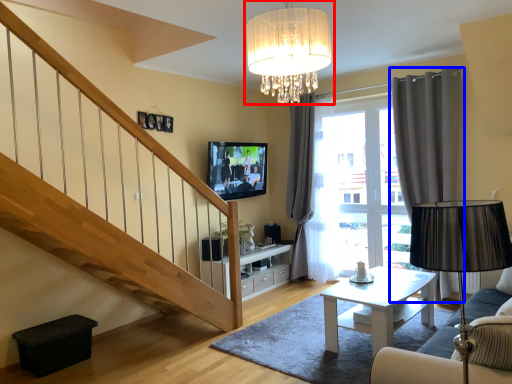
Question: Which object appears farthest to the camera in this image, lamp (highlighted by a red box) or curtain (highlighted by a blue box)?

Choices:
 (A) lamp
 (B) curtain

Answer: (B)